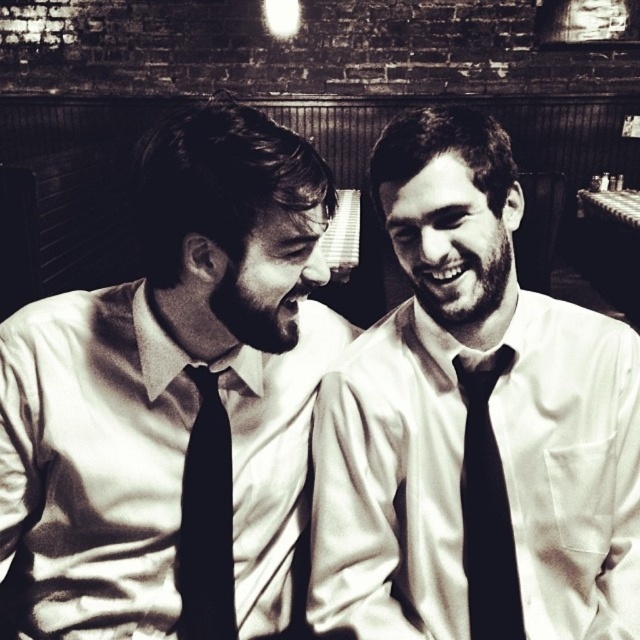
You are a photographer adjusting the focus on your camera. You want to ensure that both the matte black tie at left and the black silk tie at right are in sharp focus. Which tie should you focus on first to achieve this?

You should focus on the matte black tie at left first because it is closer to the viewer than the black silk tie at right. By focusing on the closer object, the depth of field will extend backward, potentially keeping both in focus.

You are a photographer adjusting your camera settings to focus on the matte white shirt and tie at center. If your camera has a minimum focusing distance of 40 inches, will you need to move closer or farther away to ensure the subject is in focus?

The matte white shirt and tie at center is 38.60 inches away from the camera, which is closer than the minimum focusing distance of 40 inches. Therefore, you need to move farther away to ensure the subject is in focus.